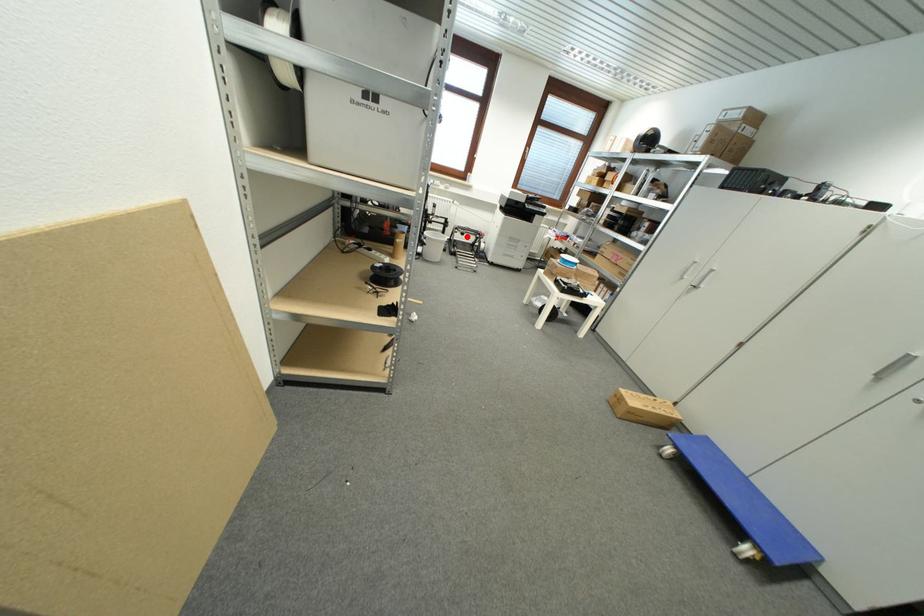
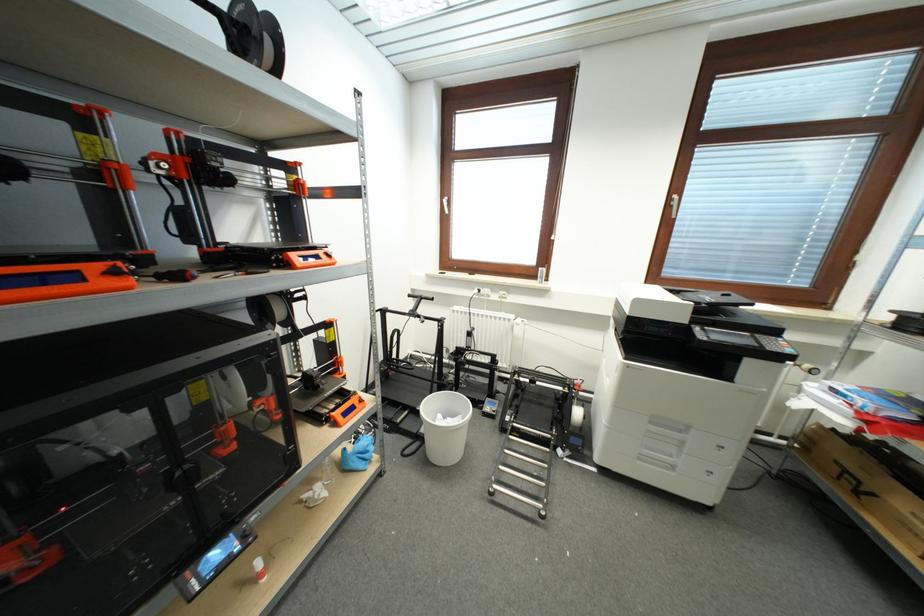
Question: A red point is marked in image1. In image2, is the corresponding 3D point closer to the camera or farther? Reply with the corresponding letter.

Choices:
 (A) The corresponding 3D point is closer.
 (B) The corresponding 3D point is farther.

Answer: (B)